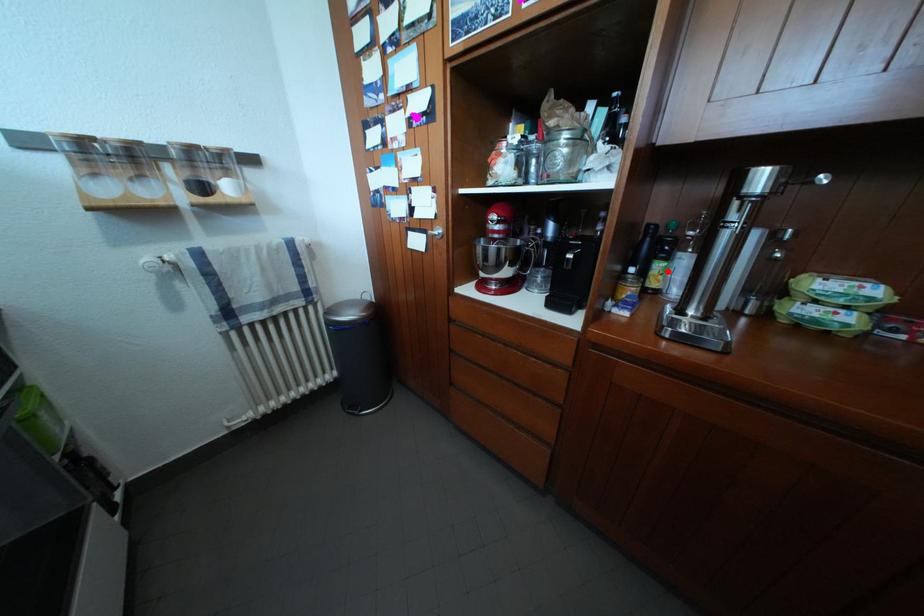
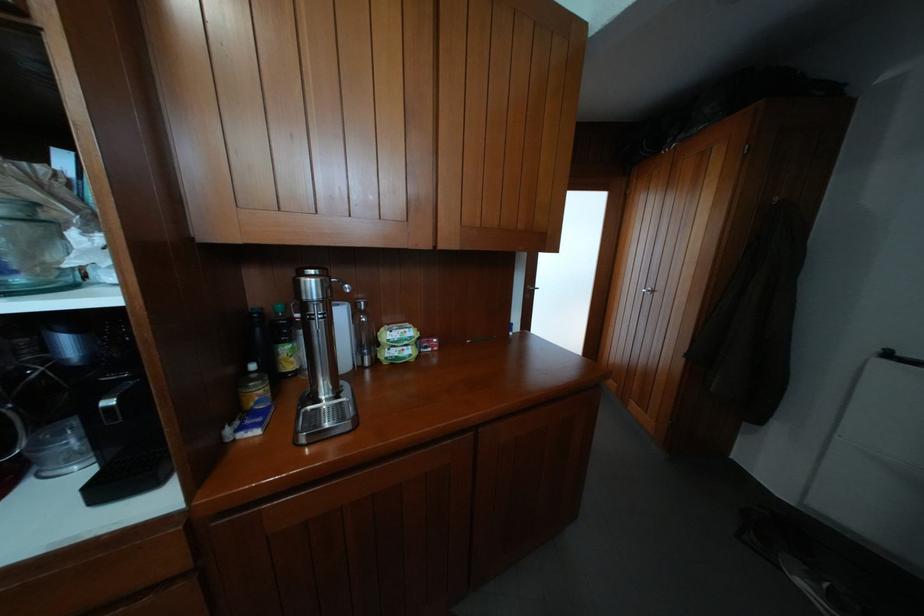
Question: I am providing you with two images of the same scene from different viewpoints. In image1, a red point is highlighted. Considering the same 3D point in image2, which of the following is correct?

Choices:
 (A) It is closer
 (B) It is farther

Answer: (B)